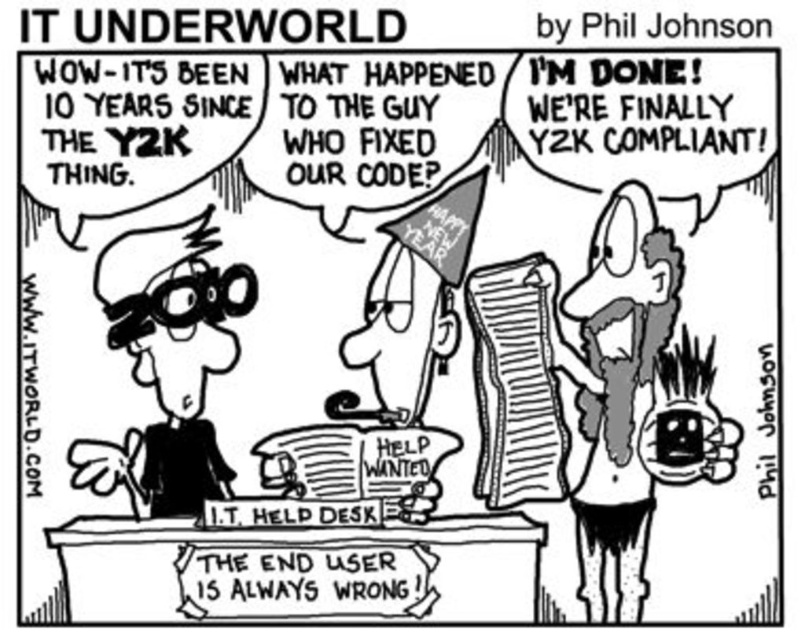
Question: Can you confirm if shaggy hair at right is bigger than matte black glasses at left?

Choices:
 (A) no
 (B) yes

Answer: (A)

Question: Among these objects, which one is farthest from the camera?

Choices:
 (A) matte black glasses at left
 (B) shaggy hair at right

Answer: (B)

Question: Is shaggy hair at right bigger than matte black glasses at left?

Choices:
 (A) yes
 (B) no

Answer: (B)

Question: Is shaggy hair at right below matte black glasses at left?

Choices:
 (A) no
 (B) yes

Answer: (B)

Question: Which point is farther from the camera taking this photo?

Choices:
 (A) (197, 397)
 (B) (634, 488)

Answer: (B)